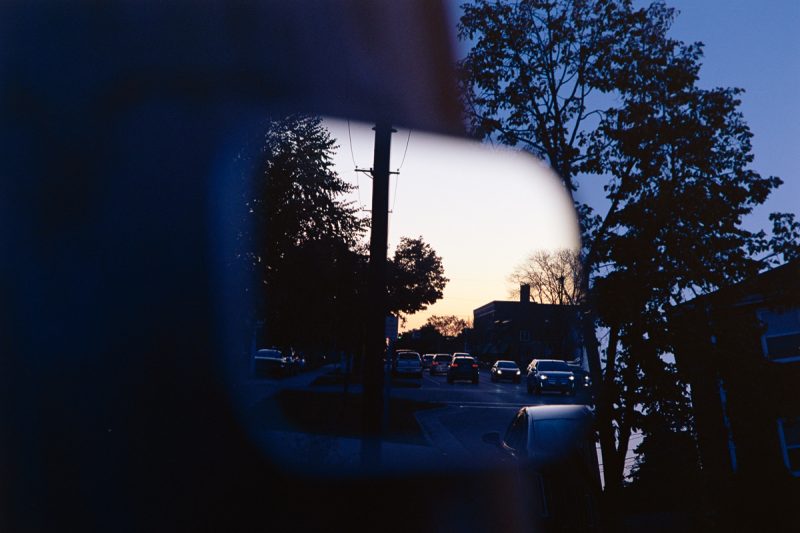
Image resolution: width=800 pixels, height=533 pixels. In order to click on mirror in this screenshot , I will do `click(486, 175)`.